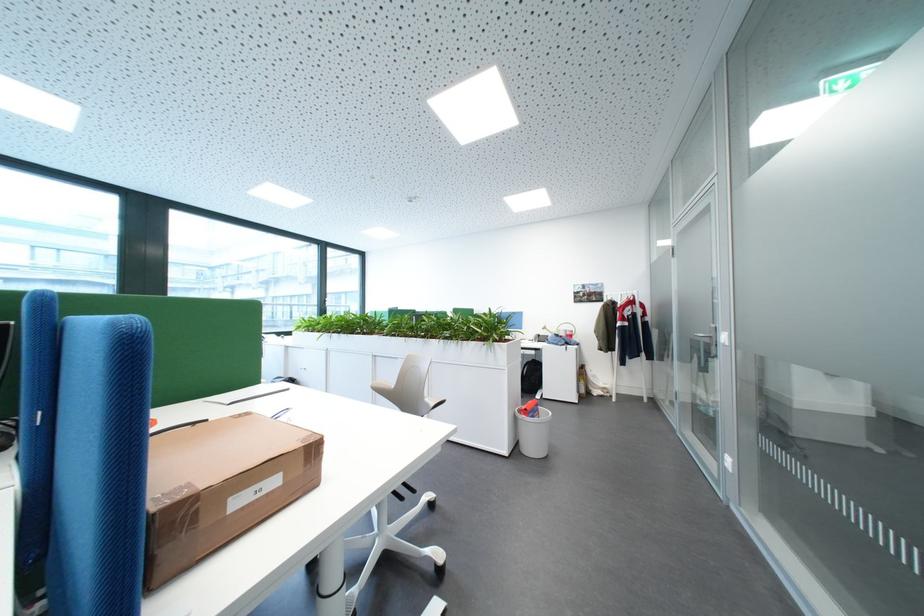
Identify the location of grey chair sitting surface. The height and width of the screenshot is (616, 924). (407, 584).